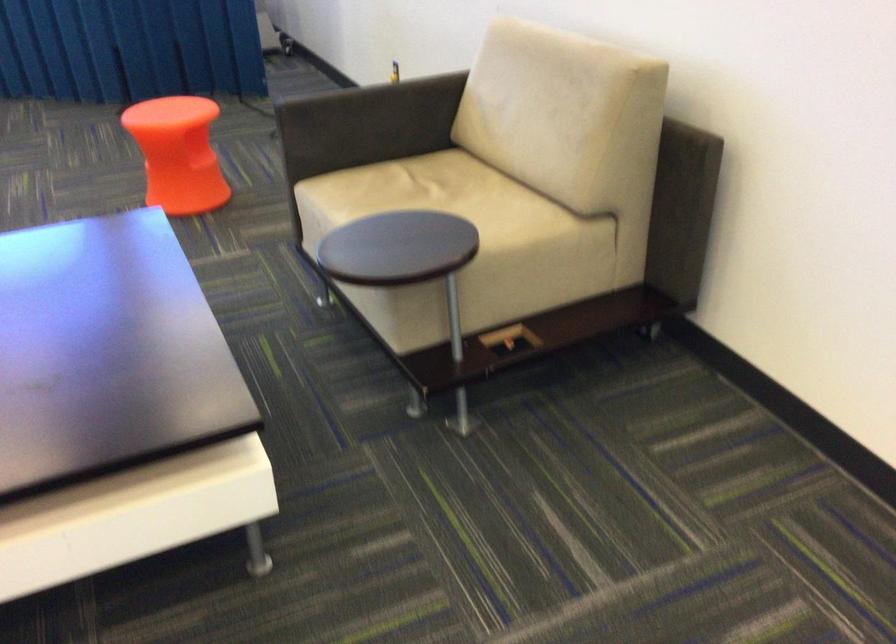
The height and width of the screenshot is (644, 896). Describe the element at coordinates (440, 194) in the screenshot. I see `a sofa sitting surface` at that location.